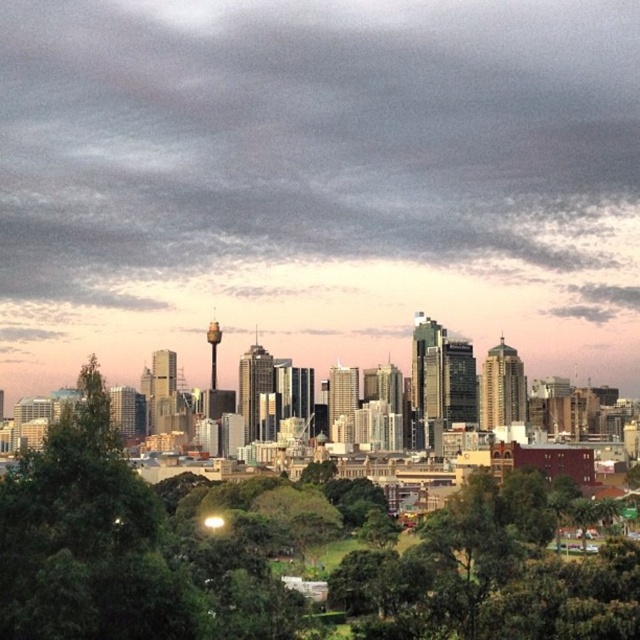
Question: Can you confirm if gray/cloudy skyline at upper center is positioned to the right of green leafy tree at center?

Choices:
 (A) yes
 (B) no

Answer: (B)

Question: Which point is closer to the camera taking this photo?

Choices:
 (A) (428, 48)
 (B) (170, 586)

Answer: (B)

Question: Does gray/cloudy skyline at upper center have a lesser width compared to green leafy tree at center?

Choices:
 (A) yes
 (B) no

Answer: (B)

Question: Does gray/cloudy skyline at upper center appear under green leafy tree at center?

Choices:
 (A) yes
 (B) no

Answer: (B)

Question: Which point is closer to the camera taking this photo?

Choices:
 (A) (205, 536)
 (B) (314, 262)

Answer: (B)